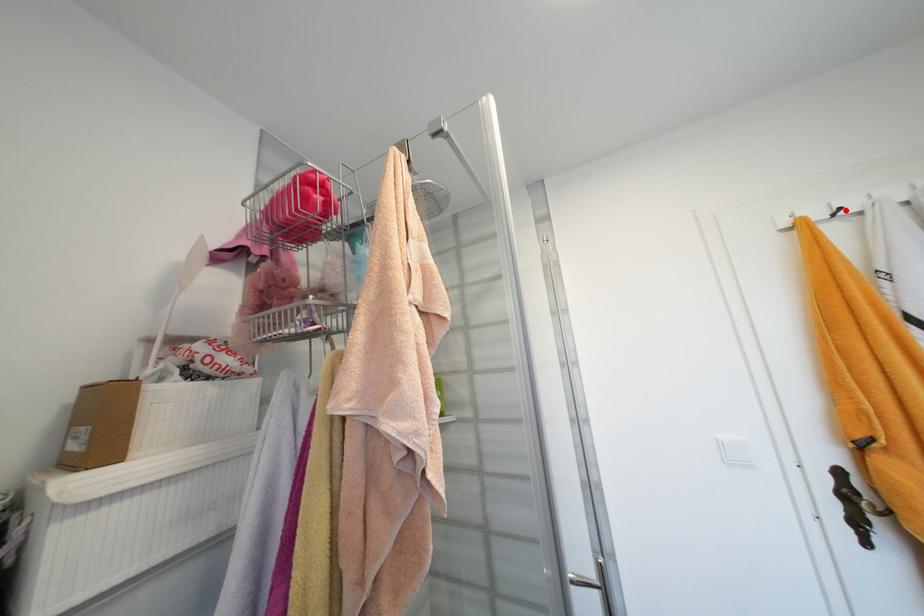
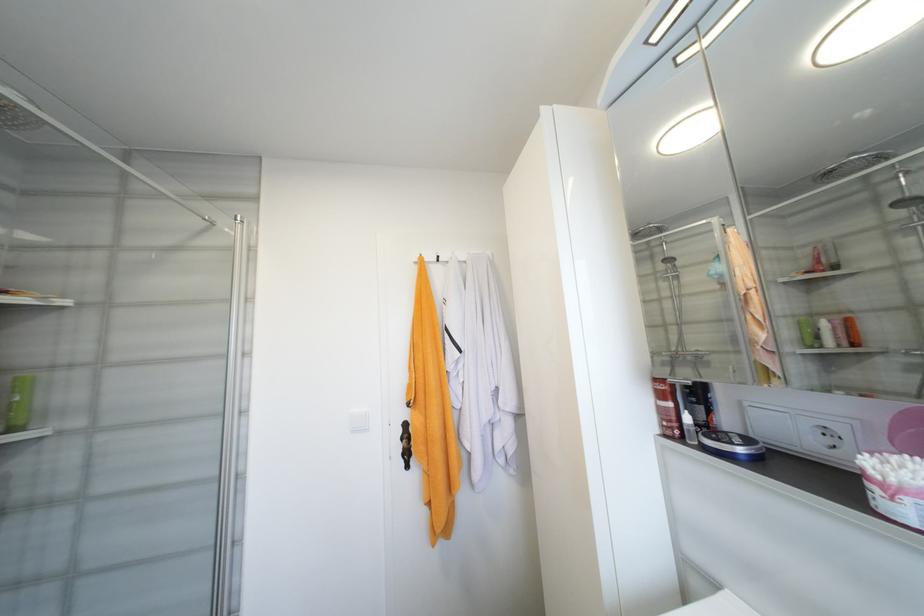
In the second image, find the point that corresponds to the highlighted location in the first image.

(444, 257)